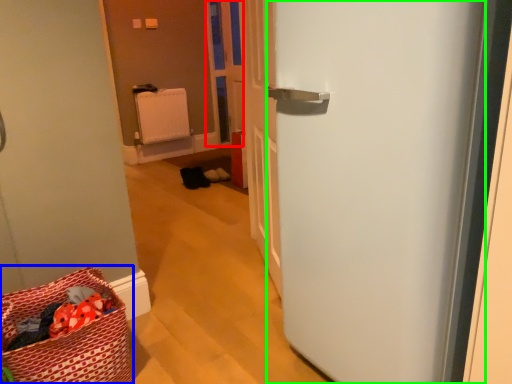
Question: Considering the real-world distances, which object is closest to screen door (highlighted by a red box)? laundry basket (highlighted by a blue box) or door (highlighted by a green box).

Choices:
 (A) laundry basket
 (B) door

Answer: (A)